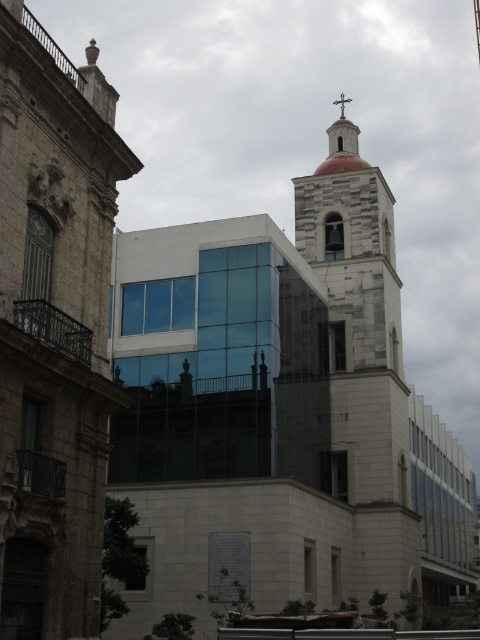
Who is lower down, white stone church at center or green metallic cross at upper center?

Positioned lower is white stone church at center.

Who is positioned more to the right, white stone church at center or green metallic cross at upper center?

Positioned to the right is green metallic cross at upper center.

This screenshot has height=640, width=480. I want to click on white stone church at center, so click(54, 326).